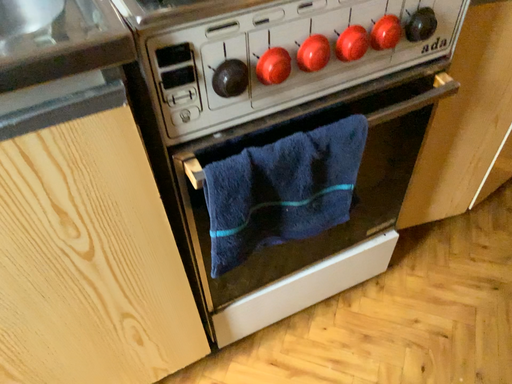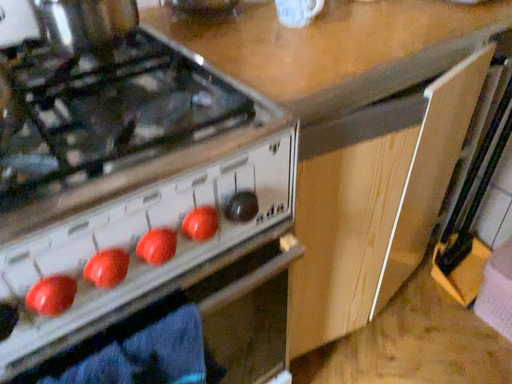
Question: Which way did the camera rotate in the video?

Choices:
 (A) rotated right
 (B) rotated left

Answer: (A)